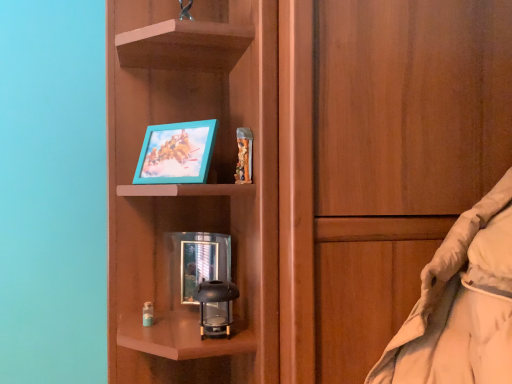
Question: Should I look upward or downward to see teal plastic picture frame at upper center, positioned as the 1th picture frame in top-to-bottom order?

Choices:
 (A) down
 (B) up

Answer: (B)

Question: From the image's perspective, is teal plastic picture frame at upper center, which ranks as the second picture frame in bottom-to-top order, beneath metallic reflective picture frame at center, the 2th picture frame positioned from the top?

Choices:
 (A) yes
 (B) no

Answer: (B)

Question: From a real-world perspective, is teal plastic picture frame at upper center, which ranks as the second picture frame in bottom-to-top order, below metallic reflective picture frame at center, which is the 1th picture frame from bottom to top?

Choices:
 (A) no
 (B) yes

Answer: (A)

Question: Is teal plastic picture frame at upper center, positioned as the 1th picture frame in top-to-bottom order, far from metallic reflective picture frame at center, the 2th picture frame positioned from the top?

Choices:
 (A) yes
 (B) no

Answer: (B)

Question: Is teal plastic picture frame at upper center, positioned as the 1th picture frame in top-to-bottom order, to the left of metallic reflective picture frame at center, the 2th picture frame positioned from the top, from the viewer's perspective?

Choices:
 (A) yes
 (B) no

Answer: (A)

Question: Does teal plastic picture frame at upper center, positioned as the 1th picture frame in top-to-bottom order, lie behind metallic reflective picture frame at center, the 2th picture frame positioned from the top?

Choices:
 (A) no
 (B) yes

Answer: (A)

Question: Considering the relative sizes of teal plastic picture frame at upper center, which ranks as the second picture frame in bottom-to-top order, and metallic reflective picture frame at center, which is the 1th picture frame from bottom to top, in the image provided, is teal plastic picture frame at upper center, which ranks as the second picture frame in bottom-to-top order, smaller than metallic reflective picture frame at center, which is the 1th picture frame from bottom to top,?

Choices:
 (A) no
 (B) yes

Answer: (A)

Question: Are metallic reflective picture frame at center, which is the 1th picture frame from bottom to top, and teal plastic picture frame at upper center, positioned as the 1th picture frame in top-to-bottom order, far apart?

Choices:
 (A) no
 (B) yes

Answer: (A)

Question: Is metallic reflective picture frame at center, which is the 1th picture frame from bottom to top, bigger than teal plastic picture frame at upper center, which ranks as the second picture frame in bottom-to-top order?

Choices:
 (A) yes
 (B) no

Answer: (B)

Question: Is metallic reflective picture frame at center, which is the 1th picture frame from bottom to top, further to camera compared to teal plastic picture frame at upper center, positioned as the 1th picture frame in top-to-bottom order?

Choices:
 (A) no
 (B) yes

Answer: (B)

Question: From the image's perspective, is metallic reflective picture frame at center, which is the 1th picture frame from bottom to top, on teal plastic picture frame at upper center, which ranks as the second picture frame in bottom-to-top order?

Choices:
 (A) yes
 (B) no

Answer: (B)

Question: Can you confirm if metallic reflective picture frame at center, which is the 1th picture frame from bottom to top, is thinner than teal plastic picture frame at upper center, which ranks as the second picture frame in bottom-to-top order?

Choices:
 (A) no
 (B) yes

Answer: (B)

Question: Can you confirm if metallic reflective picture frame at center, which is the 1th picture frame from bottom to top, is shorter than teal plastic picture frame at upper center, positioned as the 1th picture frame in top-to-bottom order?

Choices:
 (A) no
 (B) yes

Answer: (A)

Question: Considering the positions of point (166, 261) and point (178, 152), is point (166, 261) closer or farther from the camera than point (178, 152)?

Choices:
 (A) farther
 (B) closer

Answer: (A)